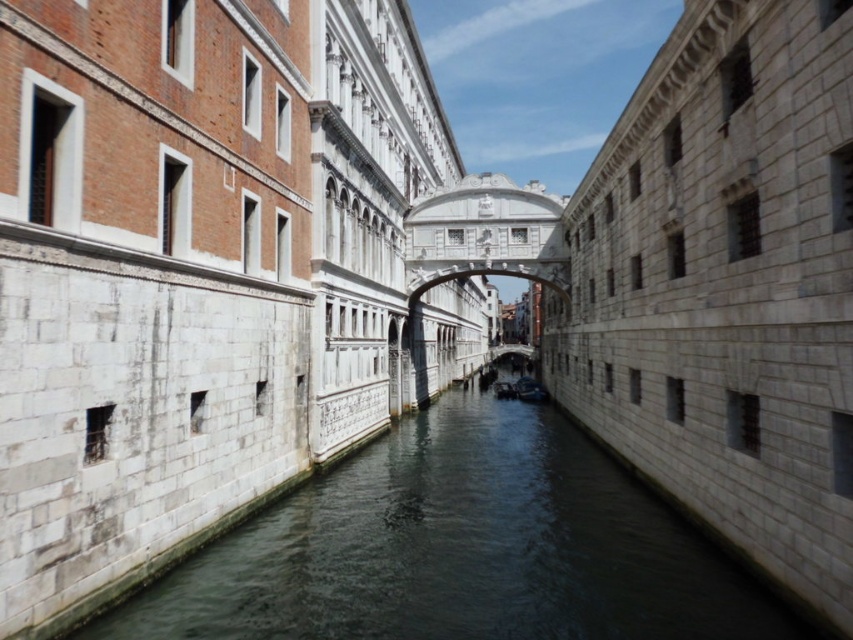
Who is positioned more to the left, dark gray stone water at center or dark blue fabric boat at center?

dark gray stone water at center

Between dark gray stone water at center and dark blue fabric boat at center, which one has less height?

dark blue fabric boat at center is shorter.

Who is more distant from viewer, (477, 600) or (523, 394)?

Positioned behind is point (523, 394).

What are the coordinates of `dark gray stone water at center` in the screenshot? It's located at (461, 548).